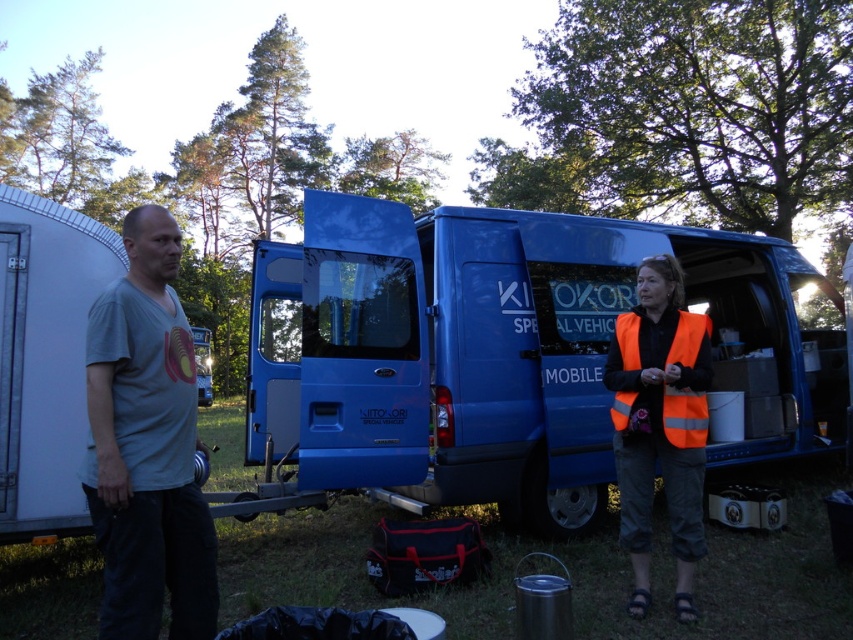
Question: Considering the real-world distances, which object is farthest from the orange reflective vest at center?

Choices:
 (A) gray cotton t-shirt at left
 (B) blue metallic van at center
 (C) orange reflective safety vest at right

Answer: (A)

Question: Can you confirm if orange reflective vest at center is positioned to the left of orange reflective safety vest at right?

Choices:
 (A) yes
 (B) no

Answer: (B)

Question: Which point appears closest to the camera in this image?

Choices:
 (A) (703, 419)
 (B) (317, 385)

Answer: (A)

Question: Does gray cotton t-shirt at left appear under orange reflective vest at center?

Choices:
 (A) no
 (B) yes

Answer: (A)

Question: Among these objects, which one is nearest to the camera?

Choices:
 (A) orange reflective vest at center
 (B) gray cotton t-shirt at left
 (C) orange reflective safety vest at right

Answer: (B)

Question: Can you confirm if orange reflective vest at center is positioned to the right of orange reflective safety vest at right?

Choices:
 (A) no
 (B) yes

Answer: (B)